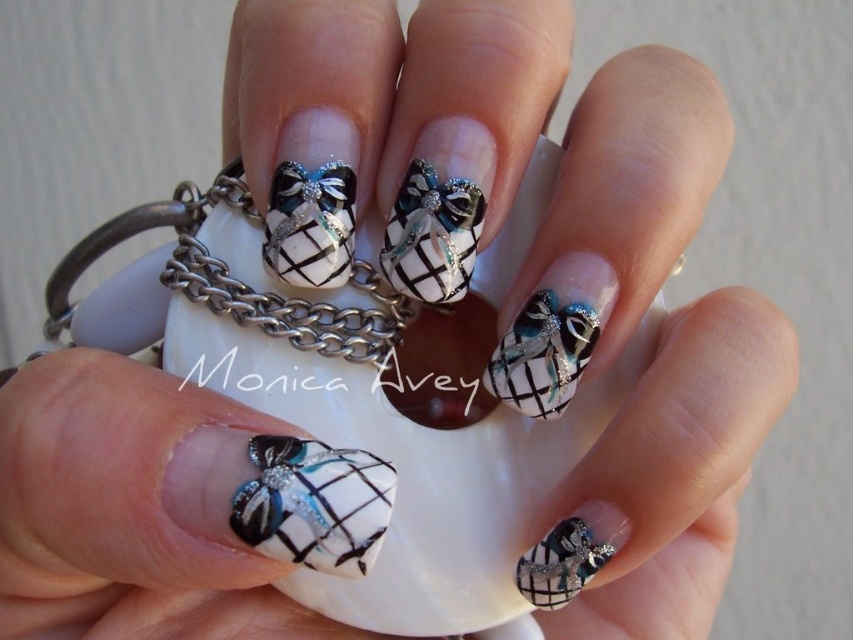
Question: Can you confirm if matte black and white nail art with bow at center is thinner than matte black and white checkered bow at center?

Choices:
 (A) no
 (B) yes

Answer: (A)

Question: Is matte black and white nail art with bow at center positioned behind matte black and white checkered bow at center?

Choices:
 (A) yes
 (B) no

Answer: (B)

Question: Can you confirm if matte black bow at center is positioned to the left of matte black and white checkered nail art at center?

Choices:
 (A) yes
 (B) no

Answer: (A)

Question: Which of the following is the closest to the observer?

Choices:
 (A) matte black and white checkered nail art at center
 (B) matte black bow at center
 (C) matte black and white nail art with bow at center

Answer: (C)

Question: Among these objects, which one is nearest to the camera?

Choices:
 (A) matte black bow at center
 (B) matte black and white nail art with bow at center
 (C) matte black nail art at center

Answer: (B)

Question: Which point appears farthest from the camera in this image?

Choices:
 (A) (509, 348)
 (B) (270, 492)
 (C) (572, 552)
 (D) (352, 244)

Answer: (A)